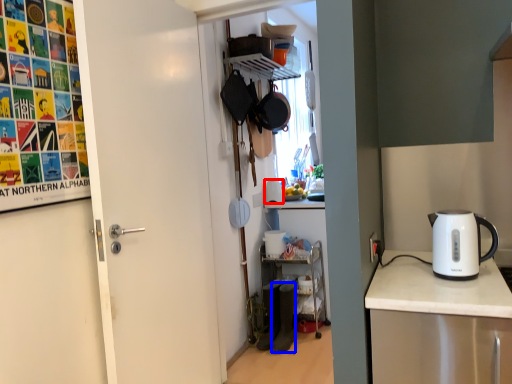
Question: Which object is further to the camera taking this photo, appliance (highlighted by a red box) or appliance (highlighted by a blue box)?

Choices:
 (A) appliance
 (B) appliance

Answer: (A)